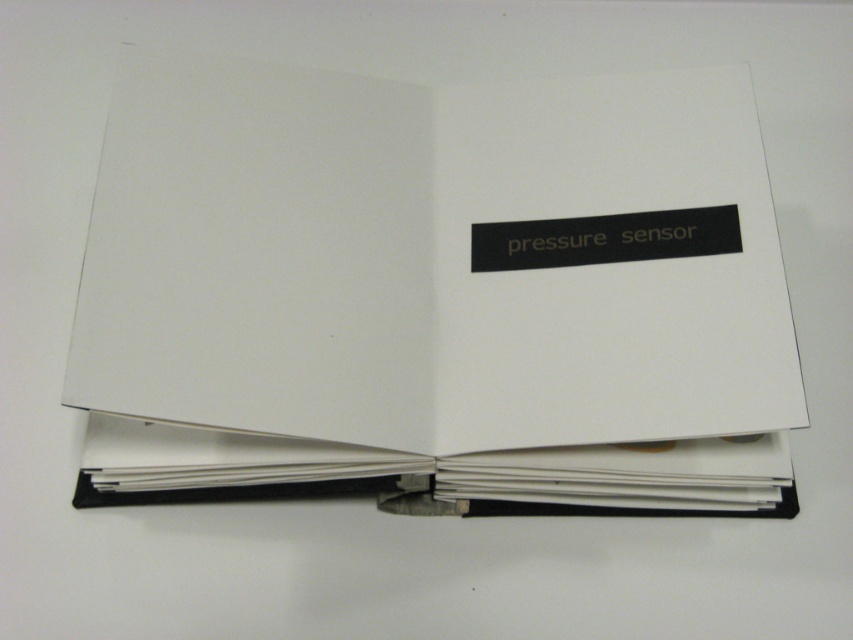
You are standing 3.70 feet away from the point labeled as point (x=653, y=291) in the image. The book is lying flat on a white surface. Can you see the black rectangular label with the text

The point (x=653, y=291) is 3.70 feet away from you. Since the book is lying flat on a white surface and the black rectangular label is on the right hand page, you can see the label if it is facing towards you. However, without knowing the orientation of the book pages relative to your position, it is impossible to determine if the label is visible from your current viewpoint.

You are looking at an open book with two points marked on its pages. The first point is at coordinates point (x=469, y=360), and the second is at point (x=115, y=454). Which point is closer to you?

Point (x=469, y=360) is further to the camera than point (x=115, y=454), so the point closer to you is point (x=115, y=454).

In the scene shown: You are organizing a desk and need to place the white paper journal at center and the white paper binder at lower center. According to the image, which item is positioned more to the right?

The white paper journal at center is positioned more to the right than the white paper binder at lower center.